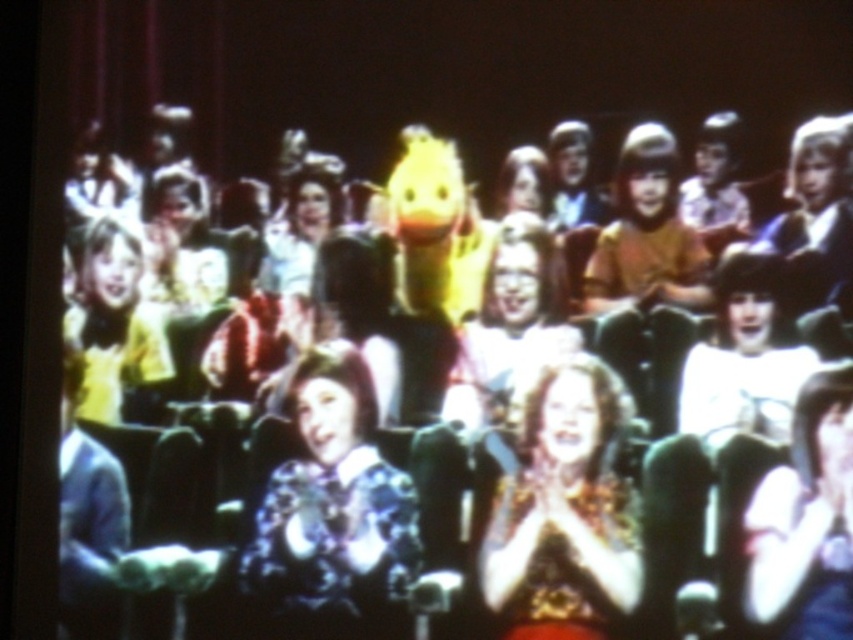
Between floral-patterned blouse at center and matte black dress at center, which one is positioned higher?

Positioned higher is floral-patterned blouse at center.

Which is in front, point (334, 440) or point (810, 577)?

Point (810, 577) is in front.

At what (x,y) coordinates should I click in order to perform the action: click on floral-patterned blouse at center. Please return your answer as a coordinate pair (x, y). This screenshot has width=853, height=640. Looking at the image, I should click on (332, 515).

Which is more to the left, curly hair at center or matte black dress at center?

curly hair at center is more to the left.

Does curly hair at center come in front of matte black dress at center?

No, curly hair at center is further to the viewer.

You are a GUI agent. You are given a task and a screenshot of the screen. Output one action in this format:
    pyautogui.click(x=<x>, y=<y>)
    Task: Click on the curly hair at center
    The width and height of the screenshot is (853, 640).
    Given the screenshot: What is the action you would take?
    pos(564,509)

Identify the location of curly hair at center. The image size is (853, 640). (564, 509).

Does floral-patterned blouse at center have a smaller size compared to matte yellow shirt at left?

No.

From the picture: Can you confirm if floral-patterned blouse at center is thinner than matte yellow shirt at left?

No, floral-patterned blouse at center is not thinner than matte yellow shirt at left.

Is point (289, 627) closer to viewer compared to point (117, 266)?

Yes, it is in front of point (117, 266).

This screenshot has width=853, height=640. What are the coordinates of `floral-patterned blouse at center` in the screenshot? It's located at (332, 515).